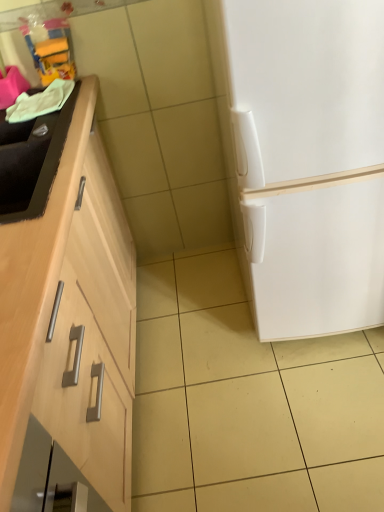
Question: Does white matte refrigerator at right appear on the left side of black matte sink at left?

Choices:
 (A) no
 (B) yes

Answer: (A)

Question: Are white matte refrigerator at right and black matte sink at left located far from each other?

Choices:
 (A) no
 (B) yes

Answer: (A)

Question: Is white matte refrigerator at right oriented away from black matte sink at left?

Choices:
 (A) yes
 (B) no

Answer: (B)

Question: Would you say white matte refrigerator at right contains black matte sink at left?

Choices:
 (A) yes
 (B) no

Answer: (B)

Question: Considering the relative sizes of white matte refrigerator at right and black matte sink at left in the image provided, is white matte refrigerator at right taller than black matte sink at left?

Choices:
 (A) no
 (B) yes

Answer: (B)

Question: Is white matte refrigerator at right to the right of black matte sink at left from the viewer's perspective?

Choices:
 (A) yes
 (B) no

Answer: (A)

Question: Is black matte sink at left facing away from white matte refrigerator at right?

Choices:
 (A) yes
 (B) no

Answer: (B)

Question: Is black matte sink at left thinner than white matte refrigerator at right?

Choices:
 (A) yes
 (B) no

Answer: (A)

Question: Would you say black matte sink at left contains white matte refrigerator at right?

Choices:
 (A) no
 (B) yes

Answer: (A)

Question: From a real-world perspective, is black matte sink at left below white matte refrigerator at right?

Choices:
 (A) no
 (B) yes

Answer: (A)

Question: Is black matte sink at left placed right next to white matte refrigerator at right?

Choices:
 (A) yes
 (B) no

Answer: (B)

Question: Can you confirm if black matte sink at left is smaller than white matte refrigerator at right?

Choices:
 (A) no
 (B) yes

Answer: (B)

Question: Considering their positions, is black matte sink at left located in front of or behind white matte refrigerator at right?

Choices:
 (A) behind
 (B) front

Answer: (A)